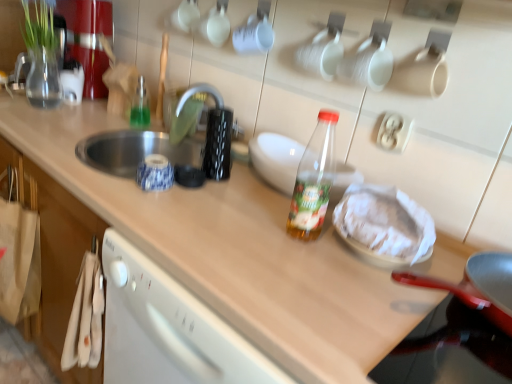
Question: Should I look upward or downward to see white paper wrapped food at center?

Choices:
 (A) up
 (B) down

Answer: (B)

Question: Is transparent plastic bottle at center, acting as the 2th bottle starting from the back, placed right next to transparent plastic bottle at center?

Choices:
 (A) no
 (B) yes

Answer: (B)

Question: Is transparent plastic bottle at center, the 2th bottle from the top, positioned behind transparent plastic bottle at center?

Choices:
 (A) no
 (B) yes

Answer: (A)

Question: From a real-world perspective, is transparent plastic bottle at center, acting as the 2th bottle starting from the back, positioned under transparent plastic bottle at center based on gravity?

Choices:
 (A) no
 (B) yes

Answer: (A)

Question: From the image's perspective, is transparent plastic bottle at center, which ranks as the 1th bottle in right-to-left order, on transparent plastic bottle at center?

Choices:
 (A) no
 (B) yes

Answer: (A)

Question: Is transparent plastic bottle at center, the 2th bottle from the top, bigger than transparent plastic bottle at center?

Choices:
 (A) no
 (B) yes

Answer: (A)

Question: From the image's perspective, would you say transparent plastic bottle at center, the 2th bottle from the top, is shown under transparent plastic bottle at center?

Choices:
 (A) no
 (B) yes

Answer: (B)

Question: Does white fabric cabinet at lower left have a smaller size compared to silver metallic faucet at upper center?

Choices:
 (A) no
 (B) yes

Answer: (A)

Question: Can you confirm if white fabric cabinet at lower left is taller than silver metallic faucet at upper center?

Choices:
 (A) no
 (B) yes

Answer: (B)

Question: Is white fabric cabinet at lower left completely or partially outside of silver metallic faucet at upper center?

Choices:
 (A) no
 (B) yes

Answer: (B)

Question: Does white fabric cabinet at lower left have a lesser width compared to silver metallic faucet at upper center?

Choices:
 (A) no
 (B) yes

Answer: (B)

Question: From a real-world perspective, does white fabric cabinet at lower left sit lower than silver metallic faucet at upper center?

Choices:
 (A) no
 (B) yes

Answer: (B)

Question: From the image's perspective, does white fabric cabinet at lower left appear lower than silver metallic faucet at upper center?

Choices:
 (A) no
 (B) yes

Answer: (B)

Question: Is transparent plastic bottle at center, acting as the 2th bottle starting from the back, facing towards white paper wrapped food at center?

Choices:
 (A) no
 (B) yes

Answer: (A)